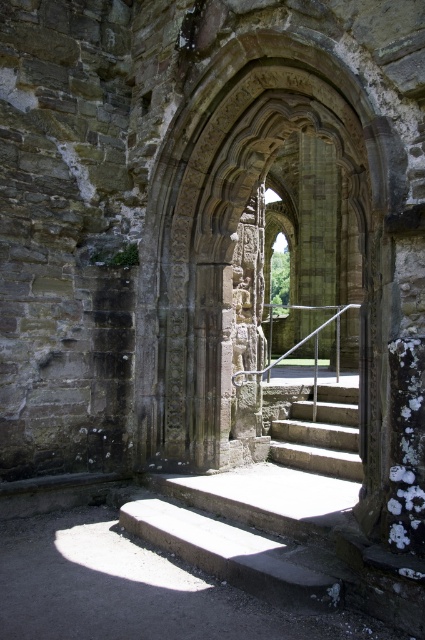
You are an architect examining the ancient structure. You need to determine if the carved stone archway at center can be seen above the smooth stone stairs at center from the bottom of the stairs. Can you confirm this?

The carved stone archway at center is taller than the smooth stone stairs at center, so yes, the archway can be seen above the stairs from the bottom.

You are standing at the base of the staircase and want to place a 8 feet long wooden plank between the carved stone archway at center and the concrete steps at center. Will the plank fit without bending?

The carved stone archway at center is 7.95 feet from concrete steps at center. The plank is 8 feet long, which is slightly longer than the distance between them. Therefore, the plank will not fit without bending.